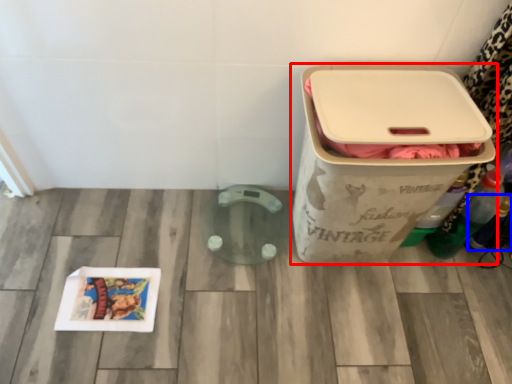
Question: Which of the following is the farthest to the observer, waste container (highlighted by a red box) or bottle (highlighted by a blue box)?

Choices:
 (A) waste container
 (B) bottle

Answer: (B)